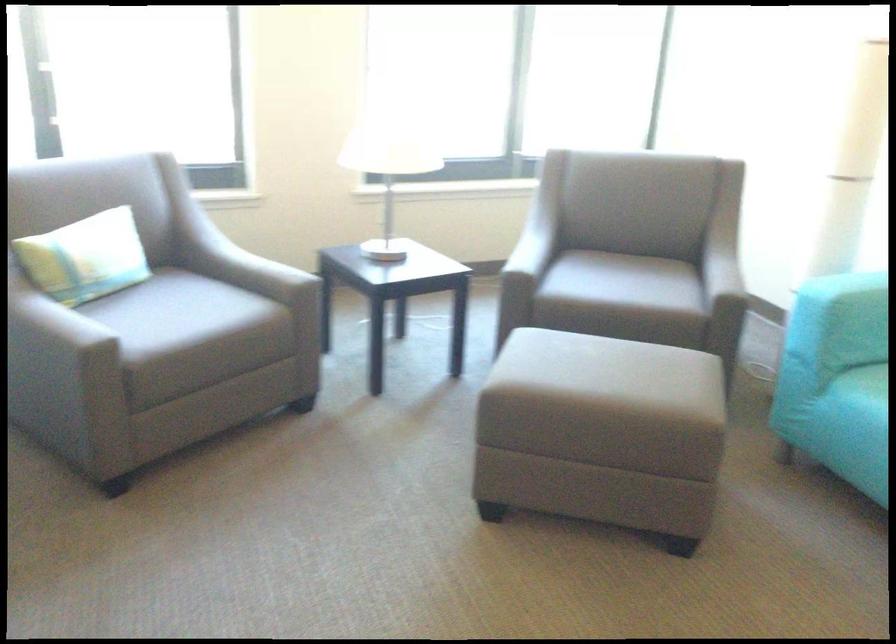
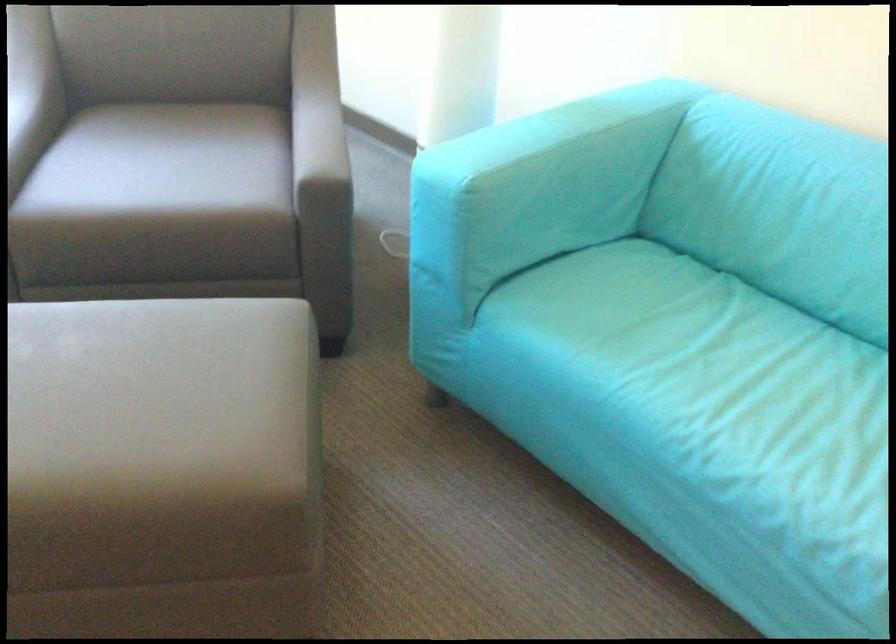
In the second image, find the point that corresponds to pixel 618 277 in the first image.

(170, 158)